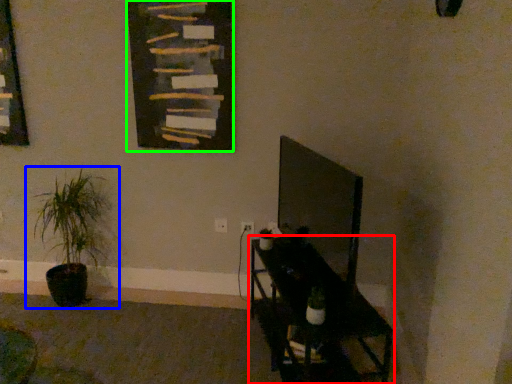
Question: Which object is positioned closest to furniture (highlighted by a red box)? Select from houseplant (highlighted by a blue box) and bulletin board (highlighted by a green box).

Choices:
 (A) houseplant
 (B) bulletin board

Answer: (B)